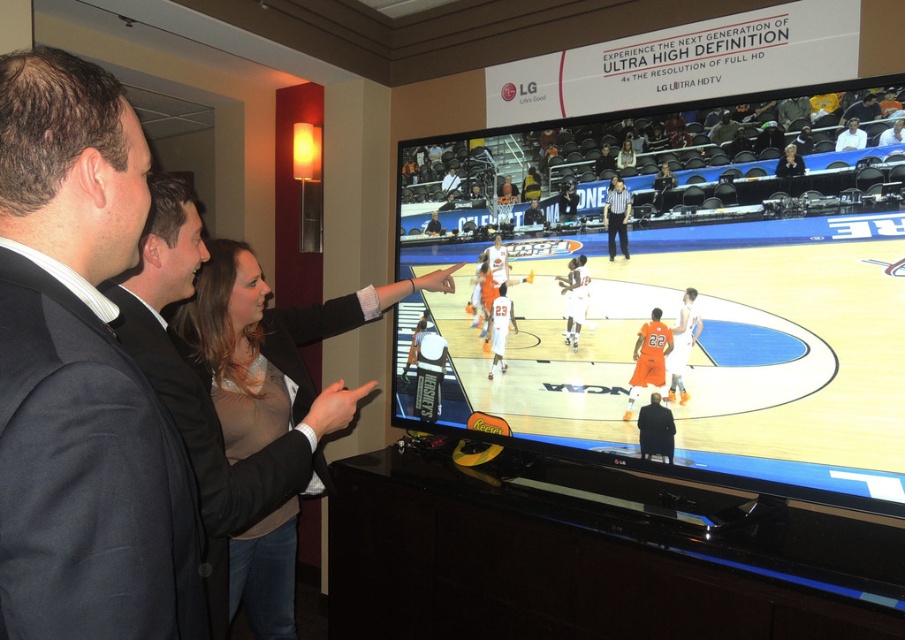
Can you confirm if dark gray suit at upper left is positioned to the right of smooth beige blouse at center?

No, dark gray suit at upper left is not to the right of smooth beige blouse at center.

Which is in front, point (110, 108) or point (624, 157)?

Point (110, 108) is in front.

Locate an element on the screen. dark gray suit at upper left is located at coordinates (81, 376).

Image resolution: width=905 pixels, height=640 pixels. I want to click on dark gray suit at upper left, so click(81, 376).

Does matte black tv at center appear under smooth beige blouse at center?

Yes, matte black tv at center is below smooth beige blouse at center.

You are a GUI agent. You are given a task and a screenshot of the screen. Output one action in this format:
    pyautogui.click(x=<x>, y=<y>)
    Task: Click on the matte black tv at center
    This screenshot has height=640, width=905.
    Given the screenshot: What is the action you would take?
    pyautogui.click(x=675, y=288)

Locate an element on the screen. The height and width of the screenshot is (640, 905). matte black tv at center is located at coordinates (675, 288).

Who is lower down, dark gray suit at upper left or matte black blazer at center?

matte black blazer at center is below.

Does dark gray suit at upper left have a lesser height compared to matte black blazer at center?

Yes.

I want to click on dark gray suit at upper left, so click(x=81, y=376).

Locate an element on the screen. dark gray suit at upper left is located at coordinates (81, 376).